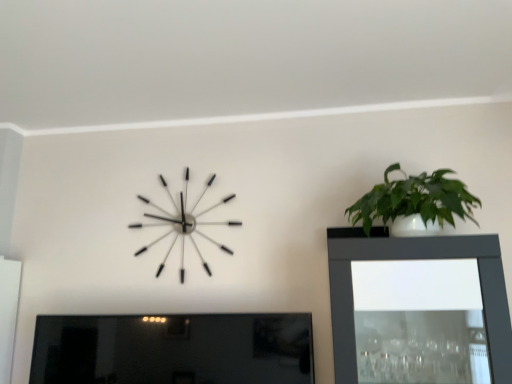
Find the location of a particular element. This screenshot has height=384, width=512. metallic silver clock at upper left is located at coordinates (183, 224).

What are the coordinates of `green glossy plant at upper right` in the screenshot? It's located at (414, 199).

Find the location of a particular element. metallic silver clock at upper left is located at coordinates (183, 224).

Would you say green glossy plant at upper right is part of matte black picture frame at lower left's contents?

No, green glossy plant at upper right is not a part of matte black picture frame at lower left.

In the scene shown: Does matte black picture frame at lower left have a larger size compared to green glossy plant at upper right?

Indeed, matte black picture frame at lower left has a larger size compared to green glossy plant at upper right.

What's the angular difference between matte black picture frame at lower left and green glossy plant at upper right's facing directions?

There is a 2.81-degree angle between the facing directions of matte black picture frame at lower left and green glossy plant at upper right.

From the image's perspective, between matte black picture frame at lower left and green glossy plant at upper right, which one is located above?

green glossy plant at upper right, from the image's perspective.

Is matte black picture frame at lower left positioned with its back to metallic silver clock at upper left?

No, matte black picture frame at lower left is not facing away from metallic silver clock at upper left.

Considering the points (52, 349) and (176, 235), which point is behind, point (52, 349) or point (176, 235)?

Positioned behind is point (176, 235).

Can metallic silver clock at upper left be found inside matte black picture frame at lower left?

That's incorrect, metallic silver clock at upper left is not inside matte black picture frame at lower left.

Does metallic silver clock at upper left appear on the left side of green glossy plant at upper right?

Indeed, metallic silver clock at upper left is positioned on the left side of green glossy plant at upper right.

Is point (170, 194) less distant than point (446, 196)?

No, it is behind (446, 196).

I want to click on wall clock below the green glossy plant at upper right (from a real-world perspective), so click(x=183, y=224).

Does metallic silver clock at upper left have a larger size compared to green glossy plant at upper right?

Incorrect, metallic silver clock at upper left is not larger than green glossy plant at upper right.

Is point (230, 224) positioned before point (254, 351)?

No, (230, 224) is behind (254, 351).

Considering the relative positions of metallic silver clock at upper left and matte black picture frame at lower left in the image provided, is metallic silver clock at upper left in front of matte black picture frame at lower left?

That is False.

Is metallic silver clock at upper left taller than matte black picture frame at lower left?

Indeed, metallic silver clock at upper left has a greater height compared to matte black picture frame at lower left.

From a real-world perspective, is metallic silver clock at upper left positioned under matte black picture frame at lower left based on gravity?

Actually, metallic silver clock at upper left is physically above matte black picture frame at lower left in the real world.

Consider the image. Considering the sizes of objects green glossy plant at upper right and metallic silver clock at upper left in the image provided, who is bigger, green glossy plant at upper right or metallic silver clock at upper left?

green glossy plant at upper right is bigger.

Is green glossy plant at upper right placed right next to metallic silver clock at upper left?

No.

Who is taller, green glossy plant at upper right or metallic silver clock at upper left?

Standing taller between the two is metallic silver clock at upper left.

Considering the relative positions of green glossy plant at upper right and metallic silver clock at upper left in the image provided, is green glossy plant at upper right to the left of metallic silver clock at upper left from the viewer's perspective?

Incorrect, green glossy plant at upper right is not on the left side of metallic silver clock at upper left.

Looking at this image, considering the relative sizes of green glossy plant at upper right and matte black picture frame at lower left in the image provided, is green glossy plant at upper right thinner than matte black picture frame at lower left?

No.

From the image's perspective, who appears lower, green glossy plant at upper right or matte black picture frame at lower left?

matte black picture frame at lower left, from the image's perspective.

Is green glossy plant at upper right taller than matte black picture frame at lower left?

Incorrect, the height of green glossy plant at upper right is not larger of that of matte black picture frame at lower left.

The width and height of the screenshot is (512, 384). What are the coordinates of `houseplant on the right of matte black picture frame at lower left` in the screenshot? It's located at (414, 199).

Where is `picture frame below the metallic silver clock at upper left (from the image's perspective)`? picture frame below the metallic silver clock at upper left (from the image's perspective) is located at coordinates [173, 349].

Looking at the image, which one is located closer to metallic silver clock at upper left, matte black picture frame at lower left or green glossy plant at upper right?

matte black picture frame at lower left is closer to metallic silver clock at upper left.

Based on the photo, when comparing their distances from green glossy plant at upper right, does metallic silver clock at upper left or matte black picture frame at lower left seem further?

matte black picture frame at lower left is further to green glossy plant at upper right.

When comparing their distances from matte black picture frame at lower left, does metallic silver clock at upper left or green glossy plant at upper right seem further?

green glossy plant at upper right is positioned further to the anchor matte black picture frame at lower left.

When comparing their distances from metallic silver clock at upper left, does green glossy plant at upper right or matte black picture frame at lower left seem further?

Based on the image, green glossy plant at upper right appears to be further to metallic silver clock at upper left.

When comparing their distances from matte black picture frame at lower left, does green glossy plant at upper right or metallic silver clock at upper left seem further?

green glossy plant at upper right is positioned further to the anchor matte black picture frame at lower left.

Based on their spatial positions, is matte black picture frame at lower left or metallic silver clock at upper left further from green glossy plant at upper right?

matte black picture frame at lower left.

Where is `wall clock situated between matte black picture frame at lower left and green glossy plant at upper right from left to right`? wall clock situated between matte black picture frame at lower left and green glossy plant at upper right from left to right is located at coordinates (183, 224).